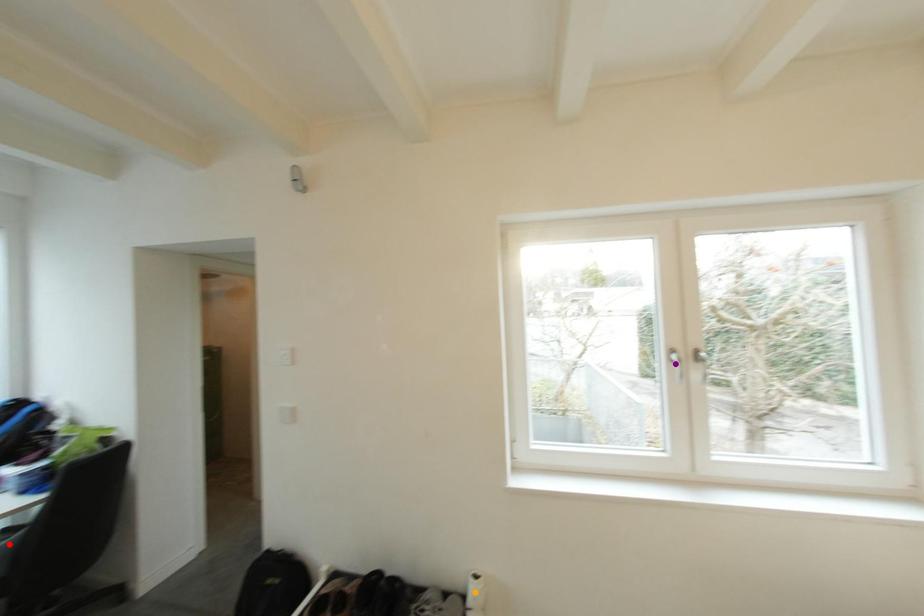
Order these from nearest to farthest:
A) red point
B) purple point
C) orange point

purple point → orange point → red point